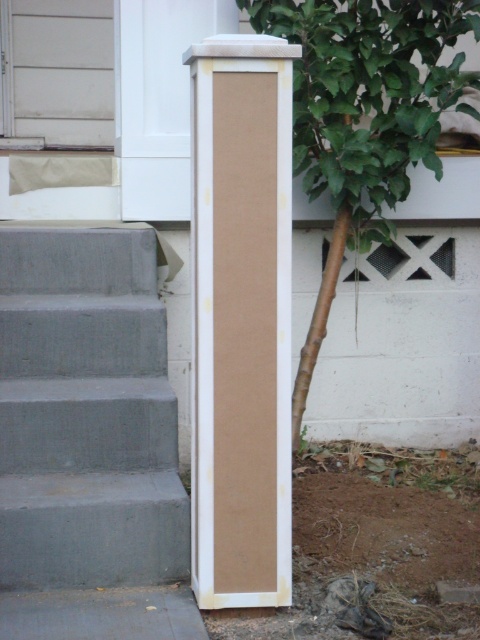
Question: Can you confirm if gray concrete stairs at lower left is wider than green leafy tree at center?

Choices:
 (A) yes
 (B) no

Answer: (B)

Question: Which point is closer to the camera?

Choices:
 (A) [344, 115]
 (B) [218, 134]
 (C) [20, 312]

Answer: (B)

Question: Which point is closer to the camera taking this photo?

Choices:
 (A) (147, 497)
 (B) (321, 168)
 (C) (276, 476)

Answer: (C)

Question: Considering the real-world distances, which object is farthest from the matte cardboard pillar at center?

Choices:
 (A) gray concrete stairs at lower left
 (B) green leafy tree at center

Answer: (B)

Question: Does matte cardboard pillar at center have a smaller size compared to green leafy tree at center?

Choices:
 (A) no
 (B) yes

Answer: (B)

Question: Is matte cardboard pillar at center smaller than green leafy tree at center?

Choices:
 (A) no
 (B) yes

Answer: (B)